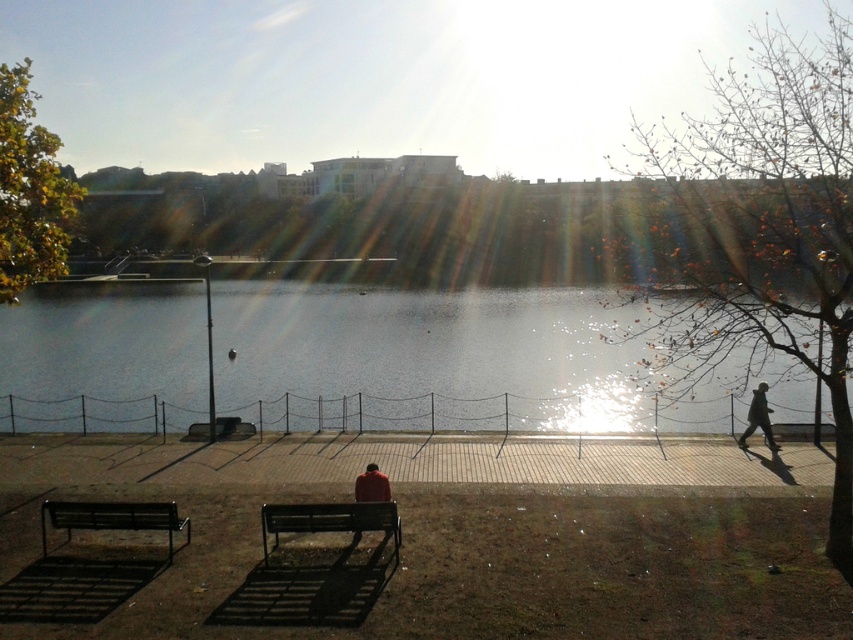
Does reflective glass water at center have a greater width compared to metallic dark bench at center?

Yes.

Where is `reflective glass water at center`? reflective glass water at center is located at coordinates (430, 348).

Who is shorter, metallic dark bench at center or red matte jacket at center?

With less height is red matte jacket at center.

Can you confirm if metallic dark bench at center is smaller than red matte jacket at center?

→ Actually, metallic dark bench at center might be larger than red matte jacket at center.

Does point (274, 525) lie in front of point (364, 499)?

Yes, it is.

Where is `metallic dark bench at center`? The image size is (853, 640). metallic dark bench at center is located at coordinates [x=329, y=518].

Who is more forward, (320, 515) or (253, 429)?

Positioned in front is point (320, 515).

Who is taller, metallic dark bench at center or metallic dark gray bench at lower center?

metallic dark bench at center is taller.

Is point (373, 508) farther from viewer compared to point (247, 436)?

No, (373, 508) is in front of (247, 436).

Where is `metallic dark bench at center`? The height and width of the screenshot is (640, 853). metallic dark bench at center is located at coordinates (329, 518).